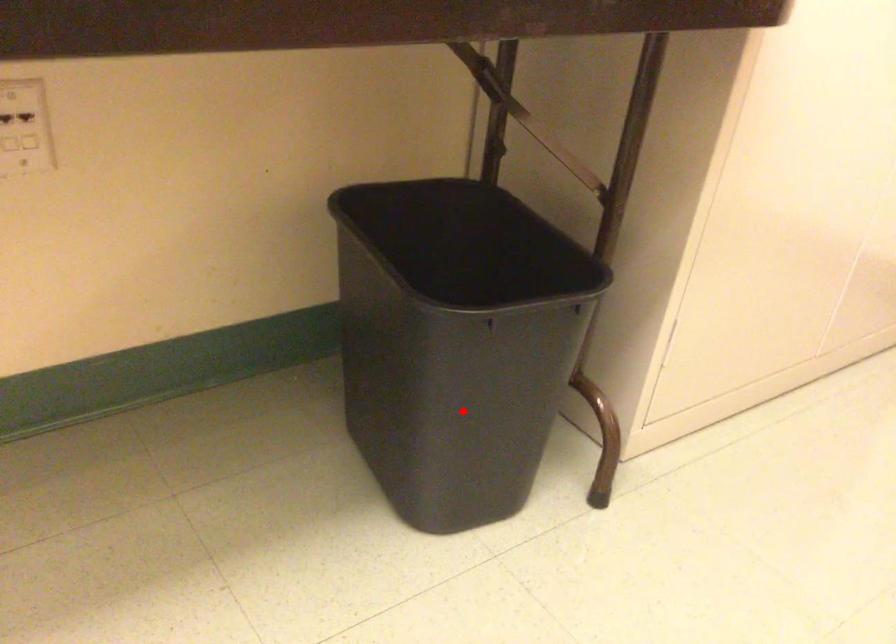
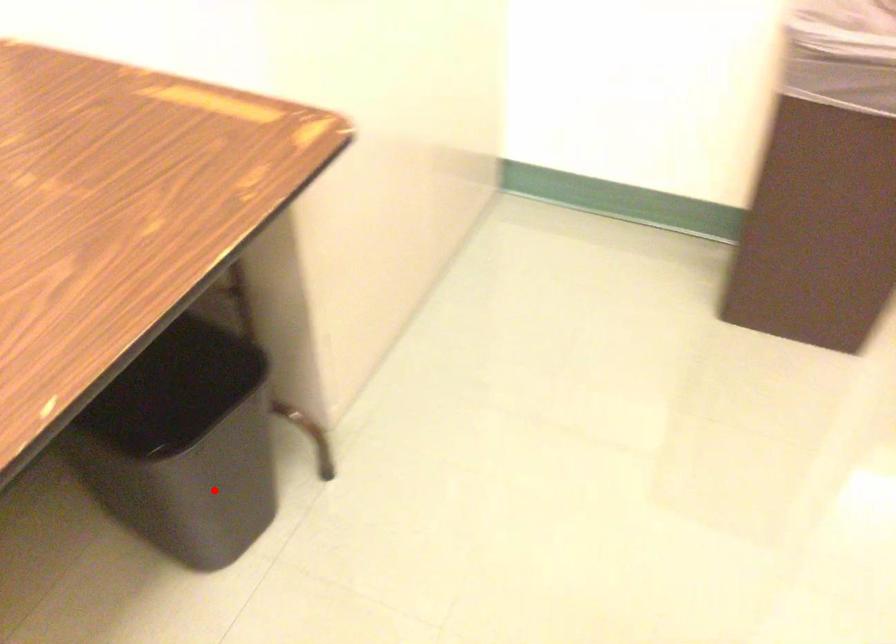
I am providing you with two images of the same scene from different viewpoints. A red point is marked on the first image and another point is marked on the second image. Do the highlighted points in image1 and image2 indicate the same real-world spot?

Yes